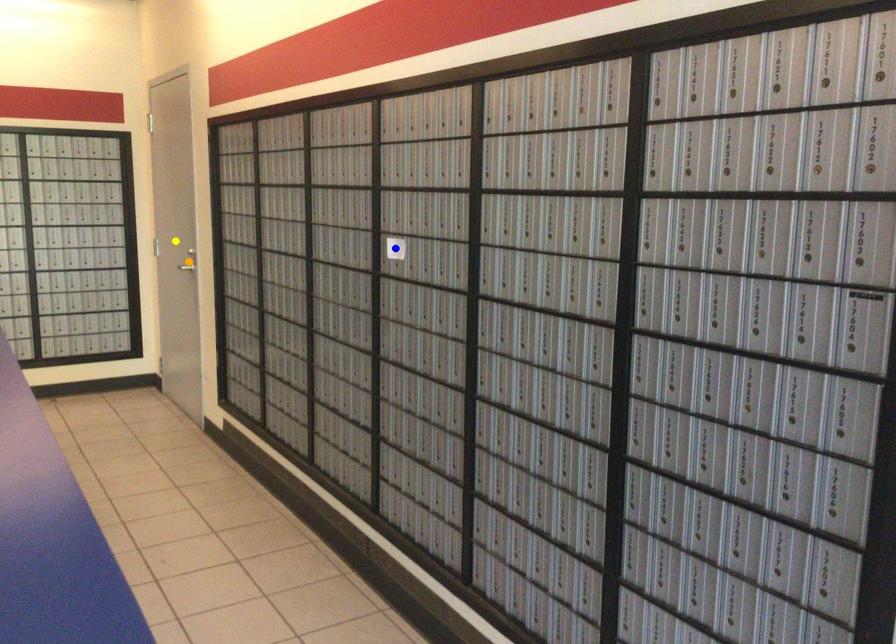
Order these from nearest to farthest:
- orange point
- blue point
- yellow point

blue point < orange point < yellow point